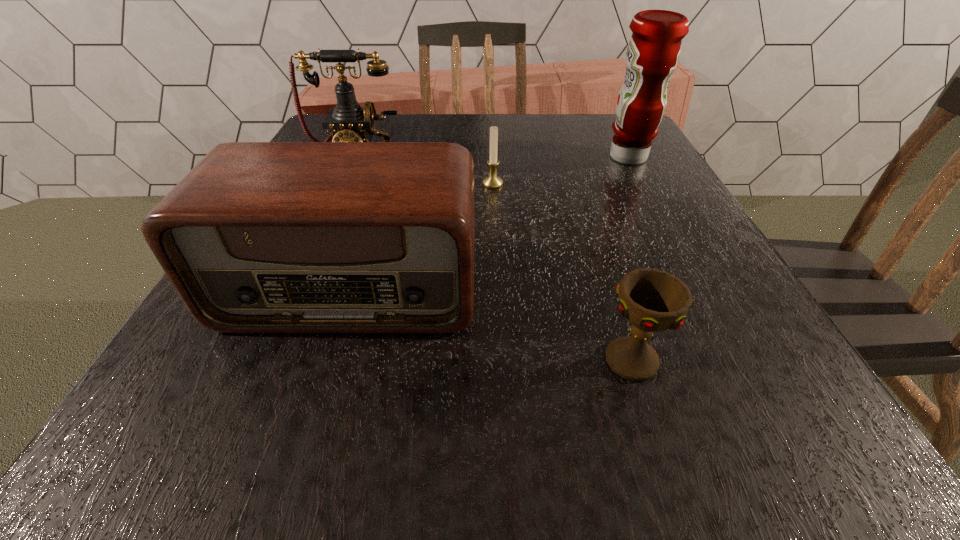
Locate an element on the screen. the tallest object is located at coordinates (654, 48).

I want to click on the rightmost object, so click(x=654, y=48).

You are a GUI agent. You are given a task and a screenshot of the screen. Output one action in this format:
    pyautogui.click(x=<x>, y=<y>)
    Task: Click on the telephone
    This screenshot has width=960, height=540.
    Given the screenshot: What is the action you would take?
    pyautogui.click(x=348, y=122)

Find the location of a particular element. The width and height of the screenshot is (960, 540). radio receiver is located at coordinates (259, 237).

Find the location of a particular element. the fourth object from left to right is located at coordinates (652, 300).

Locate an element on the screen. This screenshot has width=960, height=540. candle holder is located at coordinates (492, 181).

Identify the location of the third object from left to right. The width and height of the screenshot is (960, 540). (492, 181).

Where is `vacant space located on the left of the tallest object`? This screenshot has height=540, width=960. vacant space located on the left of the tallest object is located at coordinates (562, 157).

The image size is (960, 540). In order to click on blank space located 0.180m on the front of the telephone, featuring the rotary dial in this screenshot , I will do `click(326, 224)`.

In order to click on free space located on the front panel of the third tallest object in this screenshot , I will do `click(303, 443)`.